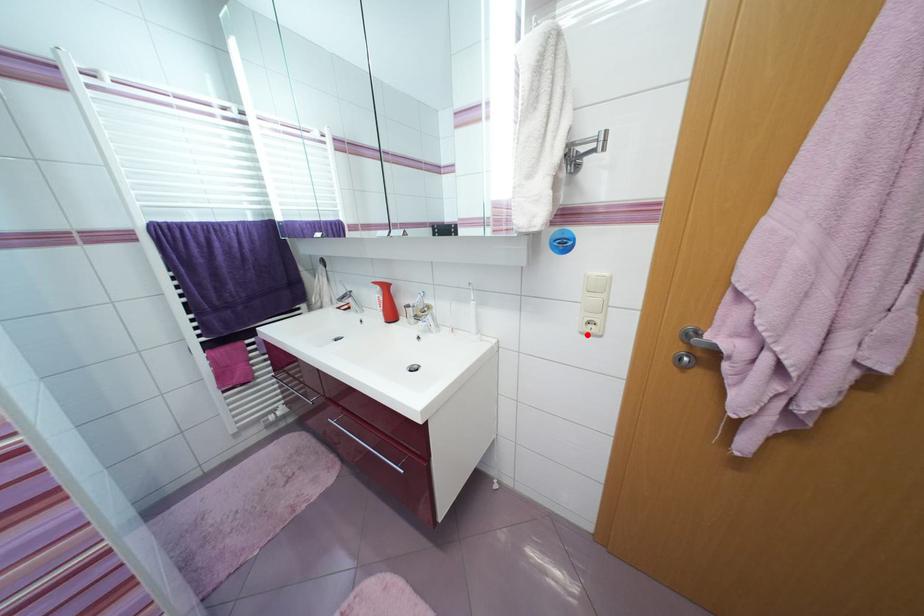
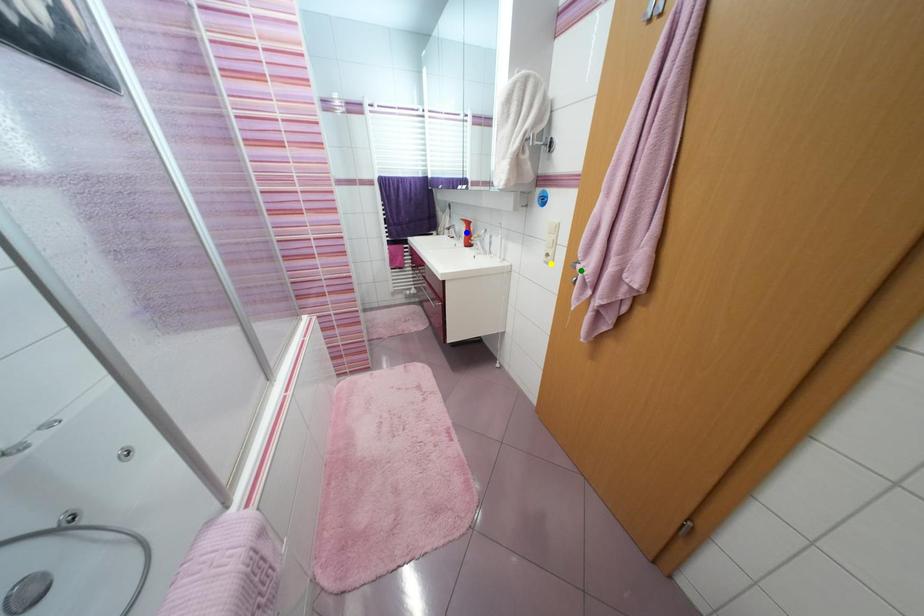
Question: I am providing you with two images of the same scene from different viewpoints. A red point is marked on the first image. You are given multiple points on the second image. Can you choose the point in image 2 that corresponds to the point in image 1?

Choices:
 (A) blue point
 (B) yellow point
 (C) green point

Answer: (B)